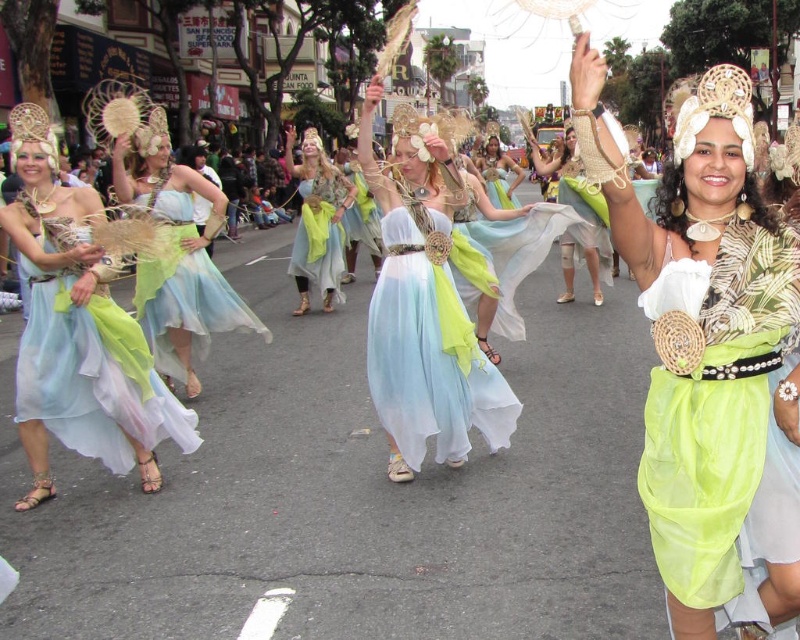
Between matte blue fabric dress at center and light blue chiffon dress at center, which one is positioned lower?

light blue chiffon dress at center is lower down.

Is matte blue fabric dress at center below light blue chiffon dress at center?

No.

Between point (304, 252) and point (512, 184), which one is positioned in front?

Point (304, 252) is more forward.

You are a GUI agent. You are given a task and a screenshot of the screen. Output one action in this format:
    pyautogui.click(x=<x>, y=<y>)
    Task: Click on the matte blue fabric dress at center
    The height and width of the screenshot is (640, 800).
    Given the screenshot: What is the action you would take?
    pyautogui.click(x=318, y=221)

At what (x,y) coordinates should I click in order to perform the action: click on pastel chiffon dress at center. Please return your answer as a coordinate pair (x, y). This screenshot has width=800, height=640. Looking at the image, I should click on (424, 307).

You are a GUI agent. You are given a task and a screenshot of the screen. Output one action in this format:
    pyautogui.click(x=<x>, y=<y>)
    Task: Click on the pastel chiffon dress at center
    This screenshot has width=800, height=640.
    Given the screenshot: What is the action you would take?
    pyautogui.click(x=424, y=307)

Where is `pastel chiffon dress at center`? pastel chiffon dress at center is located at coordinates (424, 307).

Who is more forward, [442,138] or [312,225]?

Point [442,138] is in front.

Does pastel chiffon dress at center appear under matte blue fabric dress at center?

Yes, pastel chiffon dress at center is below matte blue fabric dress at center.

I want to click on pastel chiffon dress at center, so click(424, 307).

Find the location of a particular element. This screenshot has width=800, height=640. pastel chiffon dress at center is located at coordinates (424, 307).